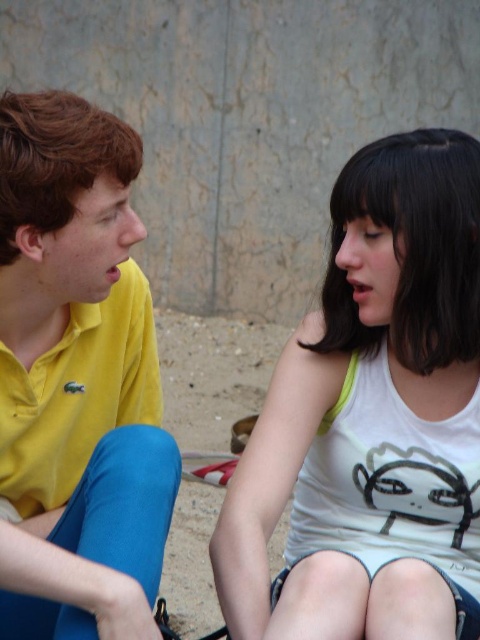
Question: Which of the following is the farthest from the observer?

Choices:
 (A) white cotton tank top at center
 (B) yellow matte polo shirt at left

Answer: (A)

Question: Is white cotton tank top at center to the right of yellow matte polo shirt at left from the viewer's perspective?

Choices:
 (A) no
 (B) yes

Answer: (B)

Question: Does white cotton tank top at center appear under yellow matte polo shirt at left?

Choices:
 (A) no
 (B) yes

Answer: (B)

Question: Among these objects, which one is farthest from the camera?

Choices:
 (A) white cotton tank top at center
 (B) yellow matte polo shirt at left

Answer: (A)

Question: Can you confirm if white cotton tank top at center is positioned above yellow matte polo shirt at left?

Choices:
 (A) no
 (B) yes

Answer: (A)